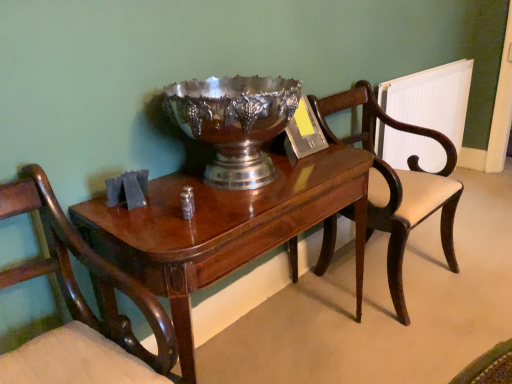
Question: Is mahogany wood chair at right, arranged as the second chair when viewed from the left, bigger or smaller than mahogany wood chair at left, which is the 2th chair from right to left?

Choices:
 (A) small
 (B) big

Answer: (B)

Question: Based on their positions, is mahogany wood chair at right, the 1th chair from the back, located to the left or right of mahogany wood chair at left, the 2th chair positioned from the back?

Choices:
 (A) right
 (B) left

Answer: (A)

Question: Which object is positioned closest to the mahogany wood chair at right, arranged as the second chair when viewed from the left?

Choices:
 (A) white plastic radiator at right
 (B) mahogany wood chair at left, positioned as the 1th chair in front-to-back order
 (C) shiny silver bowl at center
 (D) mahogany wood table at center

Answer: (D)

Question: Estimate the real-world distances between objects in this image. Which object is farther from the white plastic radiator at right?

Choices:
 (A) mahogany wood chair at left, the 2th chair positioned from the back
 (B) mahogany wood chair at right, which is the 1th chair in right-to-left order
 (C) mahogany wood table at center
 (D) shiny silver bowl at center

Answer: (A)